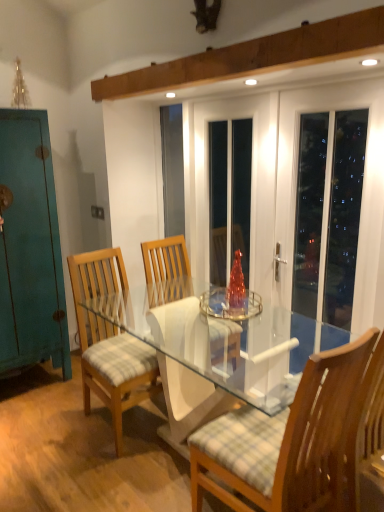
Find the location of `white glossy door at upper right`. white glossy door at upper right is located at coordinates (328, 213).

I want to click on white glossy door at upper right, so click(x=328, y=213).

From the image's perspective, is wooden chair with checkered cushion at center, marked as the second chair in a back-to-front arrangement, under teal matte cabinet at left?

Yes, from the image's perspective, wooden chair with checkered cushion at center, marked as the second chair in a back-to-front arrangement, is beneath teal matte cabinet at left.

Find the location of `cabinetry behind the wooden chair with checkered cushion at center, placed as the second chair when sorted from left to right`. cabinetry behind the wooden chair with checkered cushion at center, placed as the second chair when sorted from left to right is located at coordinates (30, 248).

Is wooden chair with checkered cushion at center, placed as the second chair when sorted from left to right, completely or partially outside of teal matte cabinet at left?

wooden chair with checkered cushion at center, placed as the second chair when sorted from left to right, is positioned outside teal matte cabinet at left.

Considering the sizes of objects light brown wood chair at center, which is the 1th chair from left to right, and wooden chair with checkered cushion at center, marked as the second chair in a back-to-front arrangement, in the image provided, who is smaller, light brown wood chair at center, which is the 1th chair from left to right, or wooden chair with checkered cushion at center, marked as the second chair in a back-to-front arrangement,?

light brown wood chair at center, which is the 1th chair from left to right, is smaller.

How far apart are light brown wood chair at center, which ranks as the 2th chair in front-to-back order, and wooden chair with checkered cushion at center, the first chair in the front-to-back sequence?

A distance of 35.79 inches exists between light brown wood chair at center, which ranks as the 2th chair in front-to-back order, and wooden chair with checkered cushion at center, the first chair in the front-to-back sequence.

Is point (86, 297) closer or farther from the camera than point (338, 403)?

Point (86, 297) is farther from the camera than point (338, 403).

From the image's perspective, which is above, light brown wood chair at center, which ranks as the 2th chair in front-to-back order, or wooden chair with checkered cushion at center, which is the first chair in right-to-left order?

light brown wood chair at center, which ranks as the 2th chair in front-to-back order, is shown above in the image.

Considering the sizes of objects light brown wood chair at center, the second chair viewed from the right, and white glossy door at upper right in the image provided, who is bigger, light brown wood chair at center, the second chair viewed from the right, or white glossy door at upper right?

With larger size is light brown wood chair at center, the second chair viewed from the right.

From the image's perspective, who appears lower, light brown wood chair at center, which ranks as the 2th chair in front-to-back order, or white glossy door at upper right?

light brown wood chair at center, which ranks as the 2th chair in front-to-back order, from the image's perspective.

Measure the distance between light brown wood chair at center, marked as the 1th chair in a back-to-front arrangement, and white glossy door at upper right.

light brown wood chair at center, marked as the 1th chair in a back-to-front arrangement, is 1.16 meters away from white glossy door at upper right.

Is point (100, 342) positioned before point (330, 319)?

That is False.

Can you tell me how much wooden chair with checkered cushion at center, which is the first chair in right-to-left order, and white glossy door at upper right differ in facing direction?

There is a 92.4-degree angle between the facing directions of wooden chair with checkered cushion at center, which is the first chair in right-to-left order, and white glossy door at upper right.

Consider the image. From the image's perspective, is wooden chair with checkered cushion at center, marked as the second chair in a back-to-front arrangement, located above or below white glossy door at upper right?

wooden chair with checkered cushion at center, marked as the second chair in a back-to-front arrangement, is below white glossy door at upper right.

Is point (320, 492) closer or farther from the camera than point (356, 197)?

Point (320, 492) appears to be closer to the viewer than point (356, 197).

Is wooden chair with checkered cushion at center, marked as the second chair in a back-to-front arrangement, with white glossy door at upper right?

No.

Would you consider light brown wood chair at center, the second chair viewed from the right, to be distant from teal matte cabinet at left?

Answer: No.

Can you tell me how much light brown wood chair at center, which is the 1th chair from left to right, and teal matte cabinet at left differ in facing direction?

light brown wood chair at center, which is the 1th chair from left to right, and teal matte cabinet at left are facing 2.85 degrees away from each other.

From a real-world perspective, between light brown wood chair at center, which ranks as the 2th chair in front-to-back order, and teal matte cabinet at left, who is vertically higher?

From a 3D spatial view, teal matte cabinet at left is above.

Is light brown wood chair at center, marked as the 1th chair in a back-to-front arrangement, turned away from teal matte cabinet at left?

Yes.

Is the position of white glossy door at upper right more distant than that of wooden chair with checkered cushion at center, which is the first chair in right-to-left order?

Yes, white glossy door at upper right is further from the camera.

How different are the orientations of white glossy door at upper right and wooden chair with checkered cushion at center, marked as the second chair in a back-to-front arrangement, in degrees?

The angle between the facing direction of white glossy door at upper right and the facing direction of wooden chair with checkered cushion at center, marked as the second chair in a back-to-front arrangement, is 92.4 degrees.

Is white glossy door at upper right beside wooden chair with checkered cushion at center, placed as the second chair when sorted from left to right?

white glossy door at upper right is not next to wooden chair with checkered cushion at center, placed as the second chair when sorted from left to right, and they're not touching.

Is light brown wood chair at center, marked as the 1th chair in a back-to-front arrangement, at the back of wooden chair with checkered cushion at center, the first chair in the front-to-back sequence?

No.

Can you confirm if wooden chair with checkered cushion at center, the first chair in the front-to-back sequence, is taller than light brown wood chair at center, which ranks as the 2th chair in front-to-back order?

Yes, wooden chair with checkered cushion at center, the first chair in the front-to-back sequence, is taller than light brown wood chair at center, which ranks as the 2th chair in front-to-back order.

In the scene shown: Based on their sizes in the image, would you say wooden chair with checkered cushion at center, placed as the second chair when sorted from left to right, is bigger or smaller than light brown wood chair at center, which ranks as the 2th chair in front-to-back order?

wooden chair with checkered cushion at center, placed as the second chair when sorted from left to right, is bigger than light brown wood chair at center, which ranks as the 2th chair in front-to-back order.

Does wooden chair with checkered cushion at center, the first chair in the front-to-back sequence, lie behind light brown wood chair at center, which is the 1th chair from left to right?

No.

This screenshot has width=384, height=512. In order to click on the 2nd chair in front when counting from the teal matte cabinet at left in this screenshot , I will do `click(285, 441)`.

Image resolution: width=384 pixels, height=512 pixels. Identify the location of chair on the right of light brown wood chair at center, marked as the 1th chair in a back-to-front arrangement. (285, 441).

From the image, which object appears to be farther from white glossy door at upper right, light brown wood chair at center, which ranks as the 2th chair in front-to-back order, or teal matte cabinet at left?

The object further to white glossy door at upper right is teal matte cabinet at left.

Which object lies nearer to the anchor point teal matte cabinet at left, white glossy door at upper right or light brown wood chair at center, marked as the 1th chair in a back-to-front arrangement?

Among the two, light brown wood chair at center, marked as the 1th chair in a back-to-front arrangement, is located nearer to teal matte cabinet at left.

Estimate the real-world distances between objects in this image. Which object is closer to teal matte cabinet at left, wooden chair with checkered cushion at center, placed as the second chair when sorted from left to right, or light brown wood chair at center, which ranks as the 2th chair in front-to-back order?

light brown wood chair at center, which ranks as the 2th chair in front-to-back order, lies closer to teal matte cabinet at left than the other object.

From the image, which object appears to be farther from light brown wood chair at center, the second chair viewed from the right, teal matte cabinet at left or white glossy door at upper right?

The object further to light brown wood chair at center, the second chair viewed from the right, is white glossy door at upper right.

From the image, which object appears to be farther from light brown wood chair at center, the second chair viewed from the right, wooden chair with checkered cushion at center, marked as the second chair in a back-to-front arrangement, or white glossy door at upper right?

white glossy door at upper right is further to light brown wood chair at center, the second chair viewed from the right.

Estimate the real-world distances between objects in this image. Which object is further from teal matte cabinet at left, white glossy door at upper right or wooden chair with checkered cushion at center, placed as the second chair when sorted from left to right?

wooden chair with checkered cushion at center, placed as the second chair when sorted from left to right, lies further to teal matte cabinet at left than the other object.

Looking at the image, which one is located further to wooden chair with checkered cushion at center, which is the first chair in right-to-left order, white glossy door at upper right or teal matte cabinet at left?

teal matte cabinet at left.

Considering their positions, is white glossy door at upper right positioned closer to light brown wood chair at center, marked as the 1th chair in a back-to-front arrangement, than wooden chair with checkered cushion at center, the first chair in the front-to-back sequence?

wooden chair with checkered cushion at center, the first chair in the front-to-back sequence, lies closer to light brown wood chair at center, marked as the 1th chair in a back-to-front arrangement, than the other object.

At what (x,y) coordinates should I click in order to perform the action: click on chair situated between light brown wood chair at center, marked as the 1th chair in a back-to-front arrangement, and white glossy door at upper right from left to right. Please return your answer as a coordinate pair (x, y). The width and height of the screenshot is (384, 512). Looking at the image, I should click on (285, 441).

Locate an element on the screen. chair situated between teal matte cabinet at left and wooden chair with checkered cushion at center, marked as the second chair in a back-to-front arrangement, from left to right is located at coordinates coord(109,340).